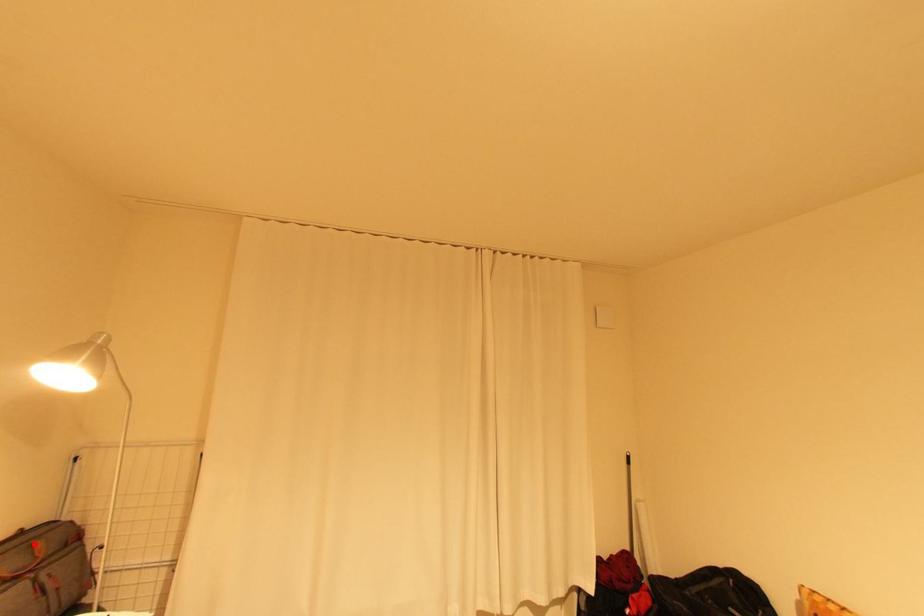
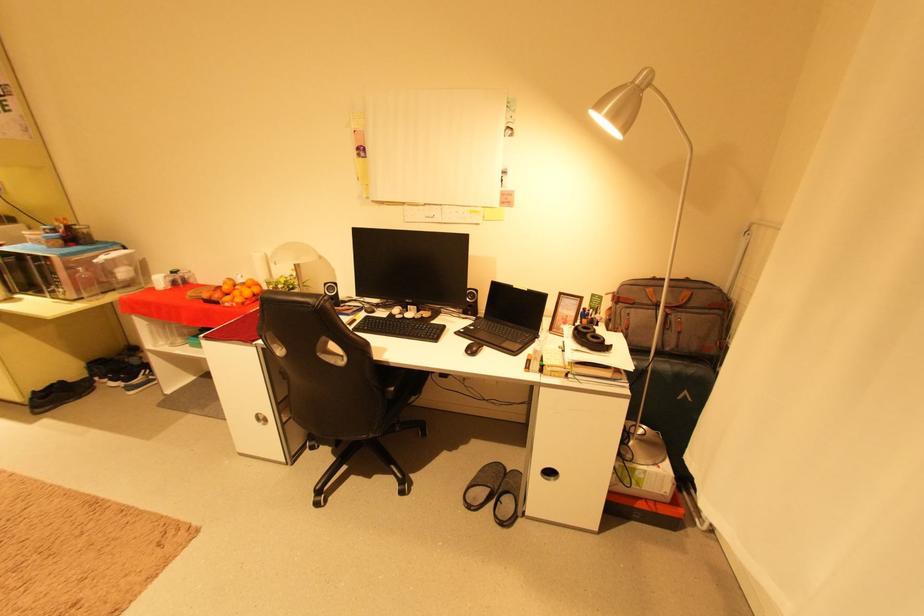
In the second image, find the point that corresponds to the highlighted location in the first image.

(688, 290)